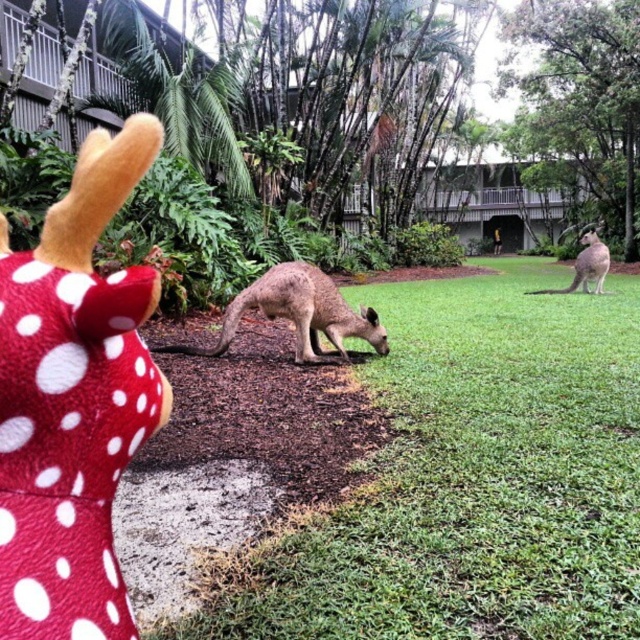
Which is behind, point (371, 320) or point (595, 236)?

The point (595, 236) is more distant.

Does point (273, 298) come closer to viewer compared to point (598, 260)?

Yes, it is in front of point (598, 260).

At what (x,y) coordinates should I click in order to perform the action: click on light brown fur at center. Please return your answer as a coordinate pair (x, y). The image size is (640, 640). Looking at the image, I should click on (298, 314).

Can you confirm if red polka dot plush at left is positioned to the right of light brown fur at center?

Correct, you'll find red polka dot plush at left to the right of light brown fur at center.

Does red polka dot plush at left have a greater width compared to light brown fur at center?

Incorrect, red polka dot plush at left's width does not surpass light brown fur at center's.

Between point (20, 376) and point (307, 308), which one is positioned in front?

Point (20, 376) is in front.

Find the location of a particular element. red polka dot plush at left is located at coordinates (74, 401).

How much distance is there between red polka dot plush at left and brown fur kangaroo at right?

A distance of 42.74 feet exists between red polka dot plush at left and brown fur kangaroo at right.

Can you confirm if red polka dot plush at left is shorter than brown fur kangaroo at right?

Yes, red polka dot plush at left is shorter than brown fur kangaroo at right.

Which is behind, point (77, 488) or point (588, 275)?

Positioned behind is point (588, 275).

Where is `red polka dot plush at left`? The width and height of the screenshot is (640, 640). red polka dot plush at left is located at coordinates (74, 401).